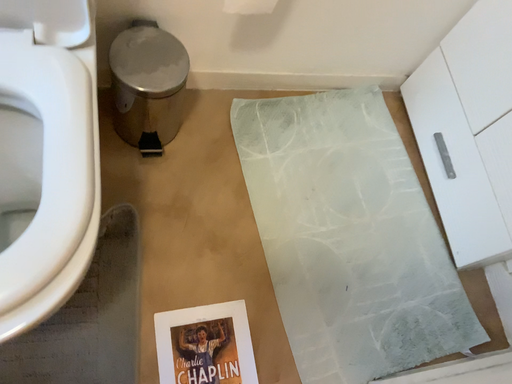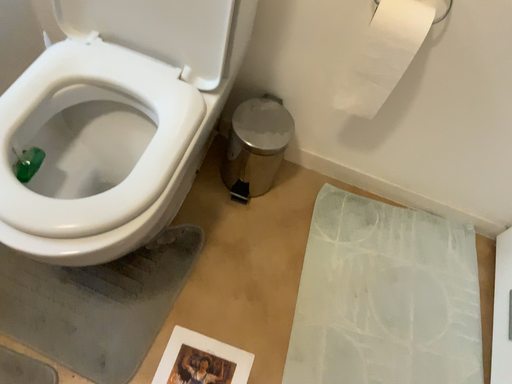
Question: How did the camera likely rotate when shooting the video?

Choices:
 (A) rotated right
 (B) rotated left

Answer: (B)